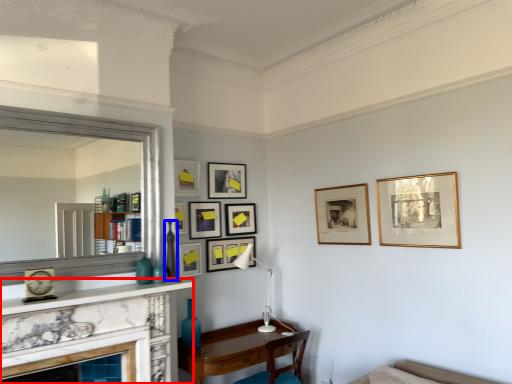
Question: Among these objects, which one is nearest to the camera, fireplace (highlighted by a red box) or vase (highlighted by a blue box)?

Choices:
 (A) fireplace
 (B) vase

Answer: (A)